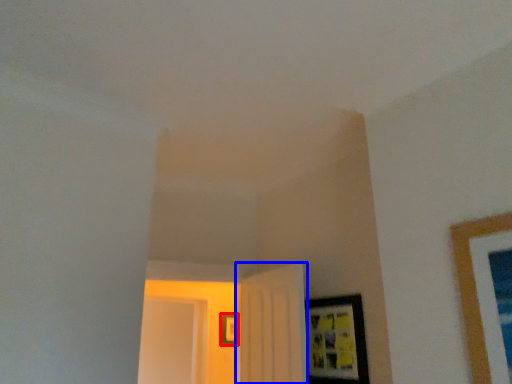
Question: Which object appears closest to the camera in this image, picture frame (highlighted by a red box) or door (highlighted by a blue box)?

Choices:
 (A) picture frame
 (B) door

Answer: (B)